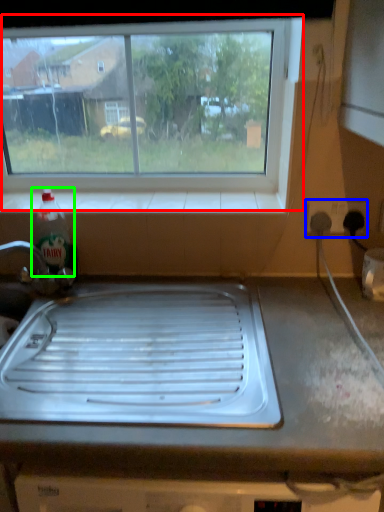
Question: Which object is the closest to the window (highlighted by a red box)? Choose among these: electric outlet (highlighted by a blue box) or bottle (highlighted by a green box).

Choices:
 (A) electric outlet
 (B) bottle

Answer: (A)